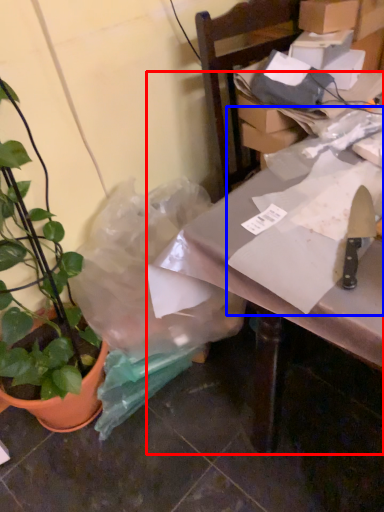
Question: Which object appears closest to the camera in this image, table (highlighted by a red box) or wrapping paper (highlighted by a blue box)?

Choices:
 (A) table
 (B) wrapping paper

Answer: (A)